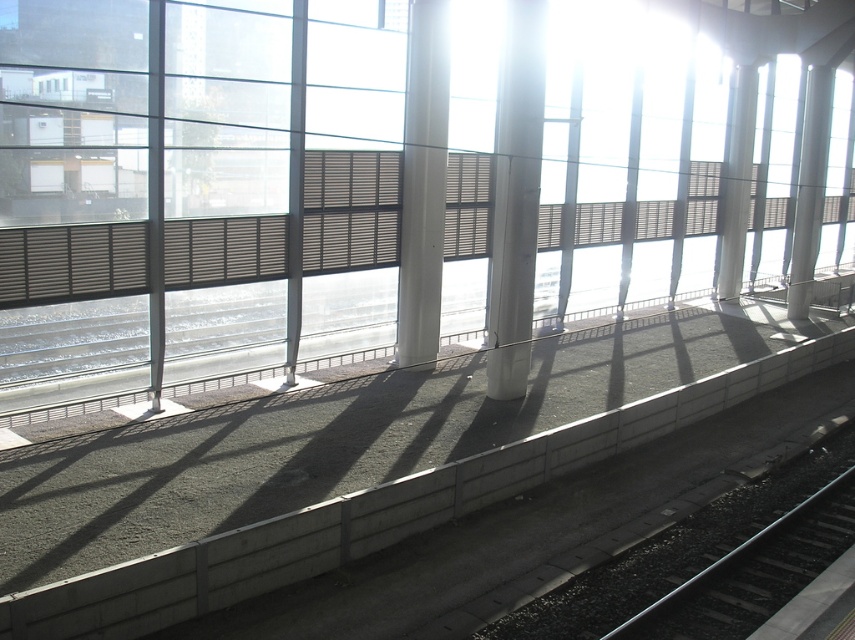
You are standing on the platform and want to walk towards the white smooth pillar at right. Which direction should you move relative to the white smooth pillar at center?

You should move to the right of the white smooth pillar at center to reach the white smooth pillar at right since the white smooth pillar at center is closer to you, indicating it is in front of the white smooth pillar at right.

You are a maintenance worker needing to replace a pillar cover. You have two covers available. One is designed for a narrower pillar and the other for a wider one. Which cover should you use for the white smooth pillar at right and which for the white glossy pillar at upper right?

The white smooth pillar at right has a lesser width compared to the white glossy pillar at upper right. Therefore, the narrower cover should be used for the white smooth pillar at right, and the wider cover should be used for the white glossy pillar at upper right.

You are standing on the platform and want to walk towards the white smooth pillar at right and the white glossy pillar at upper right. Which pillar will you reach first?

You will reach the white smooth pillar at right first because it is closer to you than the white glossy pillar at upper right.